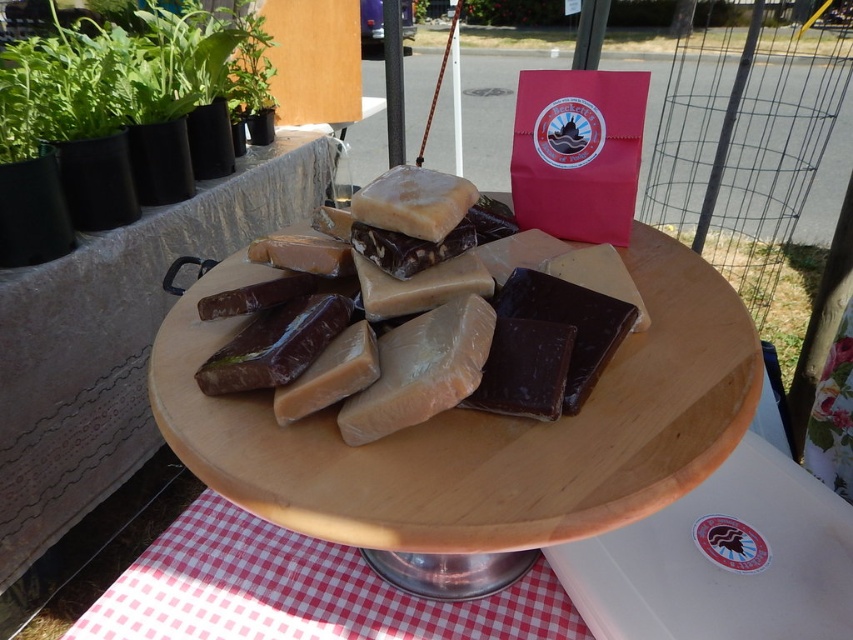
Question: Which point is closer to the camera?

Choices:
 (A) translucent plastic tray at center
 (B) dark brown hard cheese at center
 (C) wooden tray at center

Answer: (C)

Question: Which point is closer to the camera?

Choices:
 (A) (456, 362)
 (B) (283, 182)
 (C) (518, 288)
 (D) (364, 298)

Answer: (A)

Question: Considering the relative positions of dark chocolate bar at center and matte brown chocolate bar at center in the image provided, where is dark chocolate bar at center located with respect to matte brown chocolate bar at center?

Choices:
 (A) right
 (B) left

Answer: (A)

Question: Can you confirm if wooden tray at center is positioned to the left of checkered fabric at lower center?

Choices:
 (A) yes
 (B) no

Answer: (B)

Question: Which point is closer to the camera taking this photo?

Choices:
 (A) (519, 394)
 (B) (577, 406)

Answer: (A)

Question: Can you confirm if translucent plastic tray at center is positioned to the right of dark brown hard cheese at center?

Choices:
 (A) no
 (B) yes

Answer: (A)